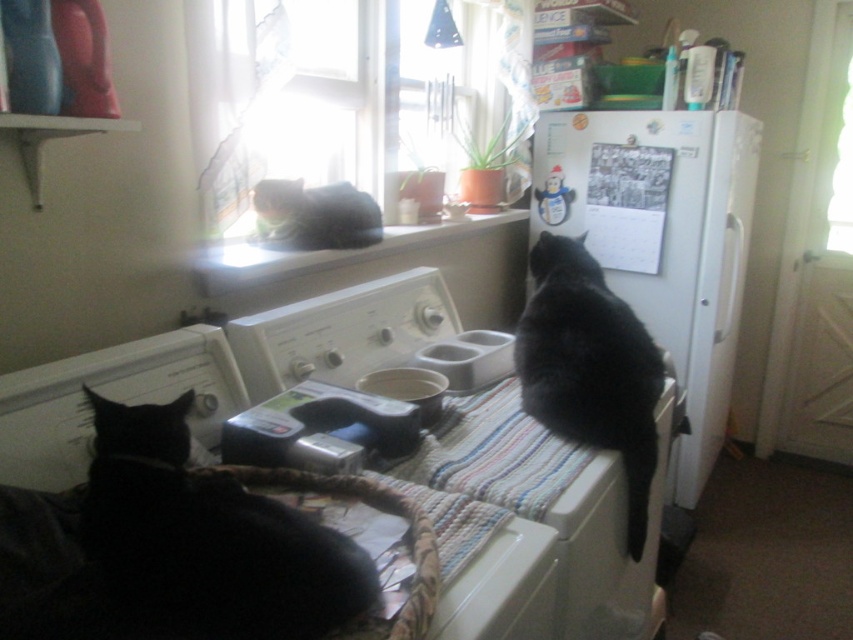
In the scene shown: Is white matte refrigerator at right to the right of white matte washing machine at upper center from the viewer's perspective?

Correct, you'll find white matte refrigerator at right to the right of white matte washing machine at upper center.

Who is more forward, [669,125] or [659,513]?

Point [659,513] is in front.

Is point (650, 132) closer to viewer compared to point (309, 321)?

No, (650, 132) is further to viewer.

Identify the location of white matte refrigerator at right. The width and height of the screenshot is (853, 640). (662, 241).

Who is positioned more to the right, black fur cat at lower left or black fur cat at upper center?

black fur cat at upper center is more to the right.

Can you confirm if black fur cat at lower left is wider than black fur cat at upper center?

Yes.

Is point (289, 588) farther from viewer compared to point (263, 193)?

No, it is not.

Locate an element on the screen. The height and width of the screenshot is (640, 853). black fur cat at lower left is located at coordinates click(x=209, y=538).

Does black fur cat at lower left have a smaller size compared to white matte washing machine at upper center?

Correct, black fur cat at lower left occupies less space than white matte washing machine at upper center.

Can you confirm if black fur cat at lower left is positioned above white matte washing machine at upper center?

Yes.

Which is in front, point (112, 563) or point (445, 333)?

Point (112, 563) is more forward.

Locate an element on the screen. This screenshot has width=853, height=640. black fur cat at lower left is located at coordinates (209, 538).